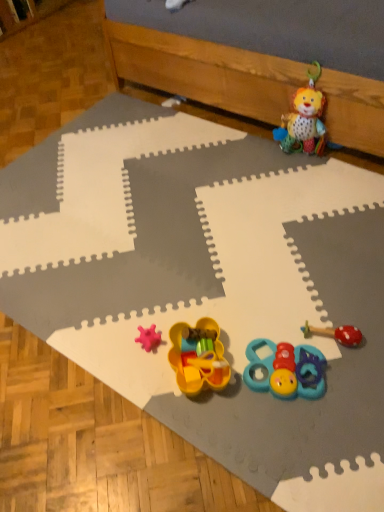
Locate an element on the screen. vacant space that is in between yellow plastic toy at center, acting as the 1th toy starting from the front, and teal rubber teething toy at lower center, the 3th toy when ordered from back to front is located at coordinates point(257,402).